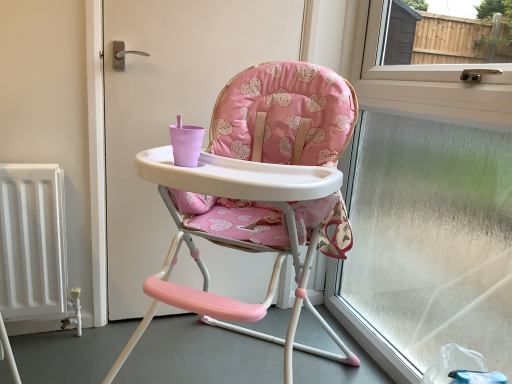
Measure the distance between transparent glass window at right and camera.

transparent glass window at right is 3.32 feet from camera.

This screenshot has height=384, width=512. Describe the element at coordinates (424, 206) in the screenshot. I see `transparent glass window at right` at that location.

Where is `transparent glass window at right`? This screenshot has width=512, height=384. transparent glass window at right is located at coordinates (424, 206).

Based on the photo, measure the distance between point [255,169] and camera.

The distance of point [255,169] from camera is 37.56 inches.

Describe the element at coordinates (258, 192) in the screenshot. I see `pink fabric highchair at center` at that location.

I want to click on pink fabric highchair at center, so click(258, 192).

Find the location of a particular element. transparent glass window at right is located at coordinates (424, 206).

Can you confirm if pink fabric highchair at center is positioned to the left of transparent glass window at right?

Indeed, pink fabric highchair at center is positioned on the left side of transparent glass window at right.

Which object is more forward, pink fabric highchair at center or transparent glass window at right?

pink fabric highchair at center.

Which is more distant, (253,310) or (364,265)?

The point (364,265) is behind.

From the image's perspective, who appears lower, pink fabric highchair at center or transparent glass window at right?

pink fabric highchair at center appears lower in the image.

From a real-world perspective, which is physically below, pink fabric highchair at center or transparent glass window at right?

In real-world perspective, pink fabric highchair at center is lower.

In terms of width, does pink fabric highchair at center look wider or thinner when compared to transparent glass window at right?

pink fabric highchair at center is wider than transparent glass window at right.

In terms of height, does pink fabric highchair at center look taller or shorter compared to transparent glass window at right?

pink fabric highchair at center is shorter than transparent glass window at right.

Which of these two, pink fabric highchair at center or transparent glass window at right, is bigger?

With larger size is pink fabric highchair at center.

Would you say pink fabric highchair at center is outside transparent glass window at right?

Indeed, pink fabric highchair at center is completely outside transparent glass window at right.

Is pink fabric highchair at center in contact with transparent glass window at right?

pink fabric highchair at center and transparent glass window at right are clearly separated.

Is pink fabric highchair at center oriented towards transparent glass window at right?

No, pink fabric highchair at center is not turned towards transparent glass window at right.

Can you tell me how much pink fabric highchair at center and transparent glass window at right differ in facing direction?

There is a 47.5-degree angle between the facing directions of pink fabric highchair at center and transparent glass window at right.

What are the coordinates of `window frame to the right of pink fabric highchair at center` in the screenshot? It's located at (424, 206).

Considering the relative positions of transparent glass window at right and pink fabric highchair at center in the image provided, is transparent glass window at right to the left of pink fabric highchair at center from the viewer's perspective?

Incorrect, transparent glass window at right is not on the left side of pink fabric highchair at center.

Looking at this image, which object is closer to the camera, transparent glass window at right or pink fabric highchair at center?

pink fabric highchair at center is closer to the camera.

Does point (423, 192) lie in front of point (327, 160)?

No.

From the image's perspective, is transparent glass window at right below pink fabric highchair at center?

No, from the image's perspective, transparent glass window at right is not below pink fabric highchair at center.

From a real-world perspective, which is physically above, transparent glass window at right or pink fabric highchair at center?

From a 3D spatial view, transparent glass window at right is above.

Between transparent glass window at right and pink fabric highchair at center, which one has smaller width?

transparent glass window at right is thinner.

In terms of height, does transparent glass window at right look taller or shorter compared to pink fabric highchair at center?

A: transparent glass window at right is taller than pink fabric highchair at center.

Which of these two, transparent glass window at right or pink fabric highchair at center, is bigger?

With larger size is pink fabric highchair at center.

Is transparent glass window at right completely or partially outside of pink fabric highchair at center?

Yes, transparent glass window at right is not within pink fabric highchair at center.

Is there a large distance between transparent glass window at right and pink fabric highchair at center?

A: transparent glass window at right is near pink fabric highchair at center, not far away.

Is transparent glass window at right looking in the opposite direction of pink fabric highchair at center?

Yes, pink fabric highchair at center is at the back of transparent glass window at right.

Measure the distance between transparent glass window at right and pink fabric highchair at center.

transparent glass window at right and pink fabric highchair at center are 20.96 inches apart.

This screenshot has height=384, width=512. Find the location of `chair below the transparent glass window at right (from the image's perspective)`. chair below the transparent glass window at right (from the image's perspective) is located at coordinates (258, 192).

Locate an element on the screen. chair that is in front of the transparent glass window at right is located at coordinates point(258,192).

Locate an element on the screen. window frame that is above the pink fabric highchair at center (from a real-world perspective) is located at coordinates (424, 206).